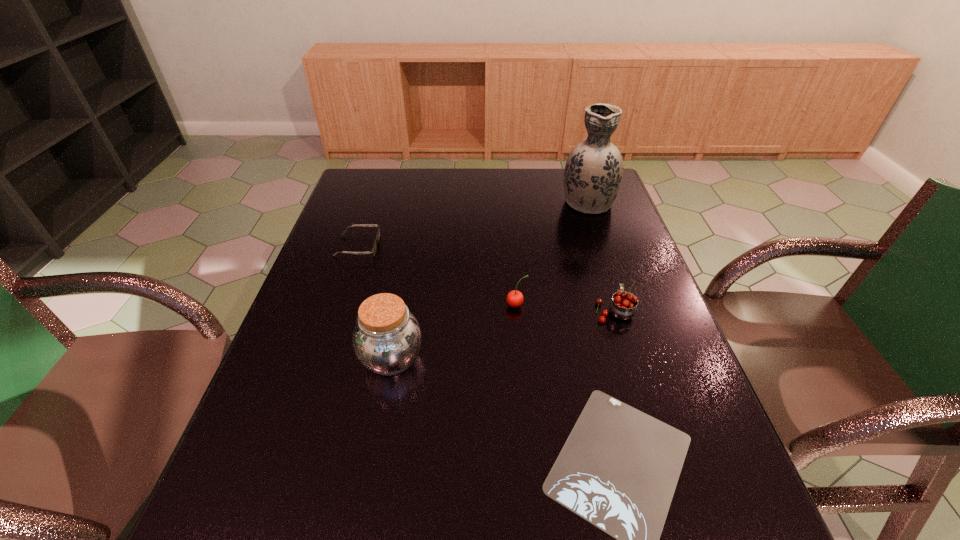
The image size is (960, 540). In order to click on free space at the near edge in this screenshot , I will do `click(312, 516)`.

Identify the location of vacant space at the left edge. (358, 204).

At what (x,y) coordinates should I click in order to perform the action: click on vacant space at the right edge. Please return your answer as a coordinate pair (x, y). Looking at the image, I should click on (636, 244).

Locate an element on the screen. Image resolution: width=960 pixels, height=540 pixels. vacant space that is in between the left cherry and the right cherry is located at coordinates (565, 308).

This screenshot has height=540, width=960. Find the location of `empty space between the tallest object and the fifth farthest object`. empty space between the tallest object and the fifth farthest object is located at coordinates (490, 280).

In order to click on vacant area that lies between the farthest object and the left cherry in this screenshot , I will do `click(552, 253)`.

Find the location of `empty space between the jar and the left cherry`. empty space between the jar and the left cherry is located at coordinates (454, 332).

The width and height of the screenshot is (960, 540). I want to click on free point between the tallest object and the second tallest object, so click(x=490, y=280).

You are a GUI agent. You are given a task and a screenshot of the screen. Output one action in this format:
    pyautogui.click(x=<x>, y=<y>)
    Task: Click on the free spot between the vase and the left cherry
    
    Given the screenshot: What is the action you would take?
    pyautogui.click(x=552, y=253)

Find the location of a particular element. vacant area that lies between the left cherry and the right cherry is located at coordinates (565, 308).